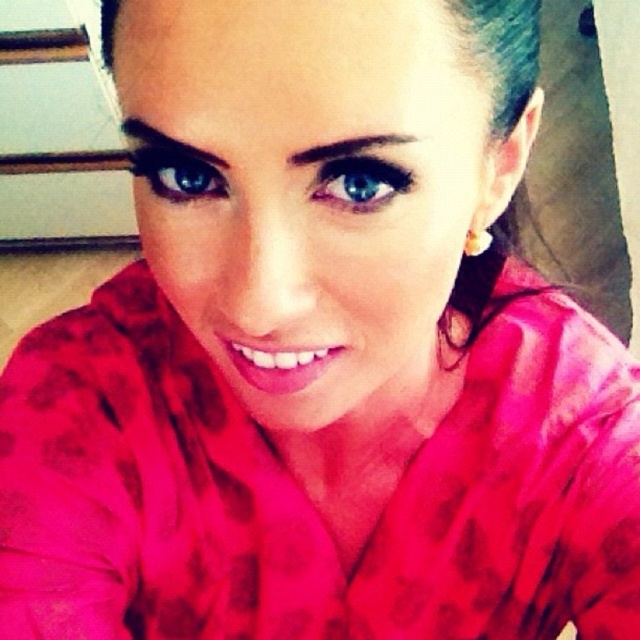
From the picture: You are an artist trying to paint the eyes of the person in the image. Which eye has a smaller width between the blue glossy eye at center and the blue glossy eye at upper center?

The blue glossy eye at center has a smaller width than the blue glossy eye at upper center.